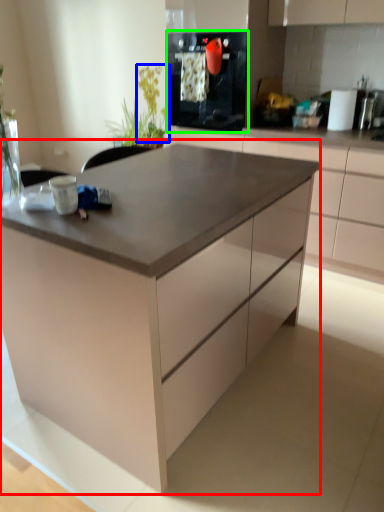
Question: Estimate the real-world distances between objects in this image. Which object is farther from table (highlighted by a red box), plant (highlighted by a blue box) or kitchen appliance (highlighted by a green box)?

Choices:
 (A) plant
 (B) kitchen appliance

Answer: (A)